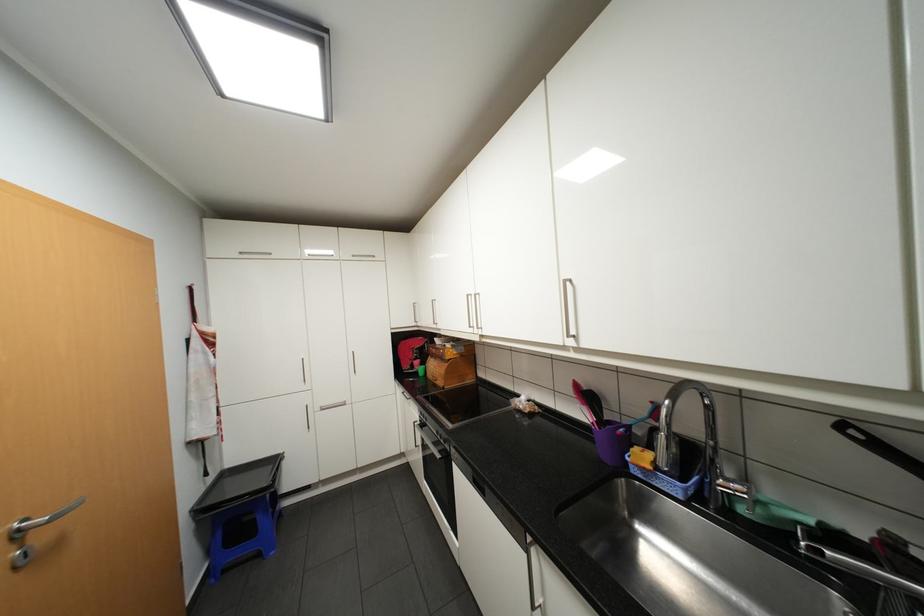
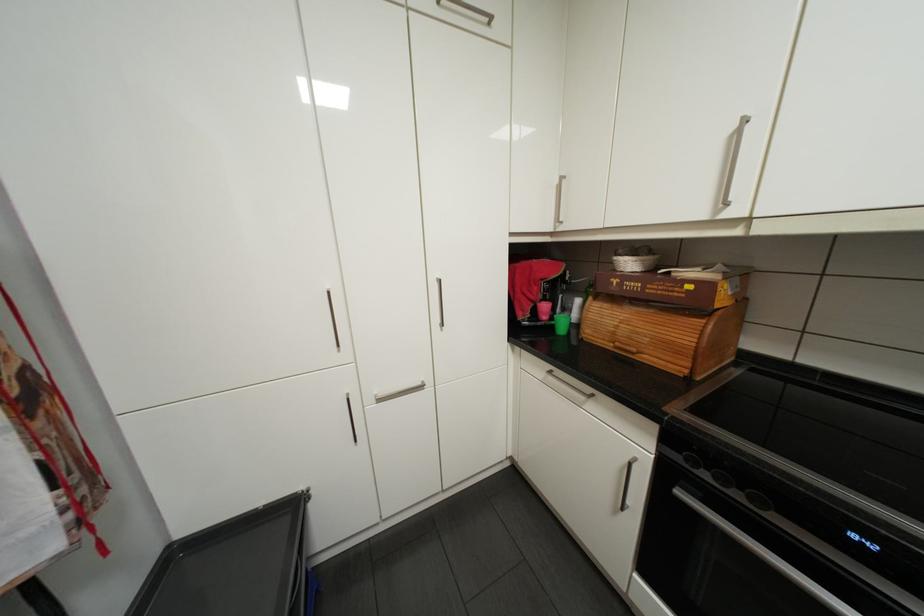
Where in the second image is the point corresponding to point 424,371 from the first image?

(557, 328)